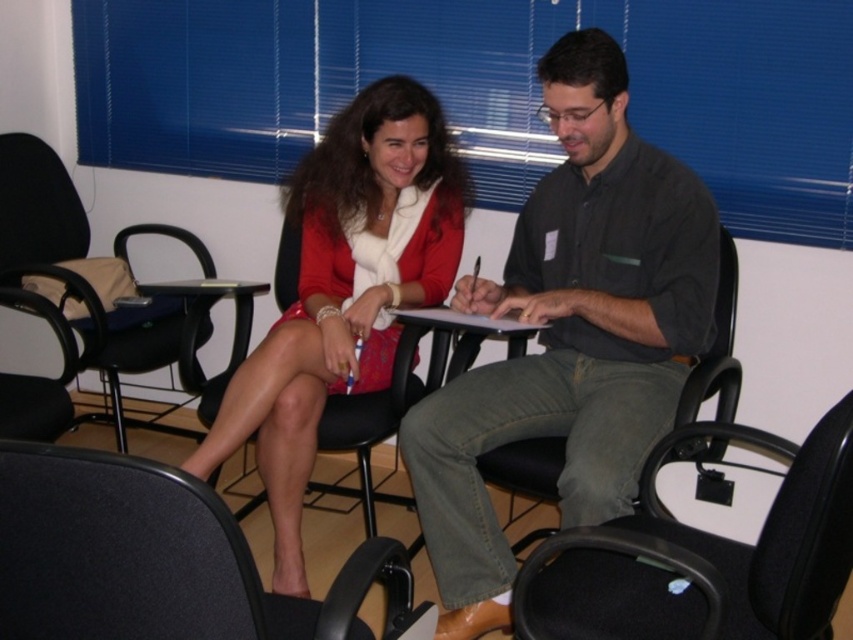
Question: Based on their relative distances, which object is farther from the matte plastic clipboard at center?

Choices:
 (A) dark gray shirt at center
 (B) matte red dress at center
 (C) black fabric swivel chair at center

Answer: (C)

Question: Is matte red dress at center above black plastic table at center?

Choices:
 (A) no
 (B) yes

Answer: (B)

Question: Which object is farther from the camera taking this photo?

Choices:
 (A) dark gray shirt at center
 (B) black plastic table at center
 (C) black fabric swivel chair at lower left
 (D) black fabric chair at left

Answer: (B)

Question: Estimate the real-world distances between objects in this image. Which object is closer to the black plastic table at center?

Choices:
 (A) black fabric swivel chair at lower left
 (B) matte red dress at center
 (C) matte plastic clipboard at center

Answer: (B)

Question: In this image, where is dark gray shirt at center located relative to black fabric swivel chair at center?

Choices:
 (A) right
 (B) left

Answer: (B)

Question: Can you confirm if black fabric swivel chair at lower left is smaller than black fabric swivel chair at center?

Choices:
 (A) no
 (B) yes

Answer: (B)